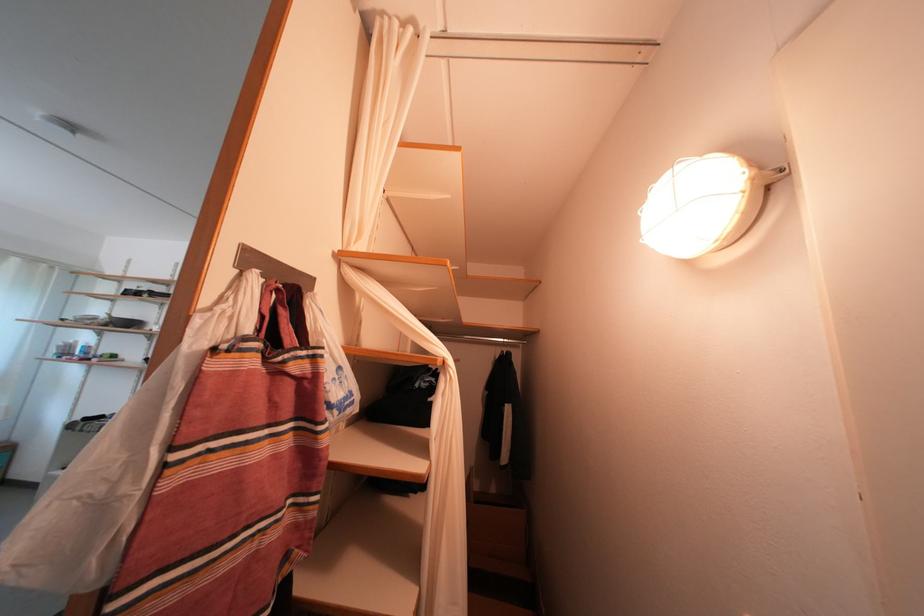
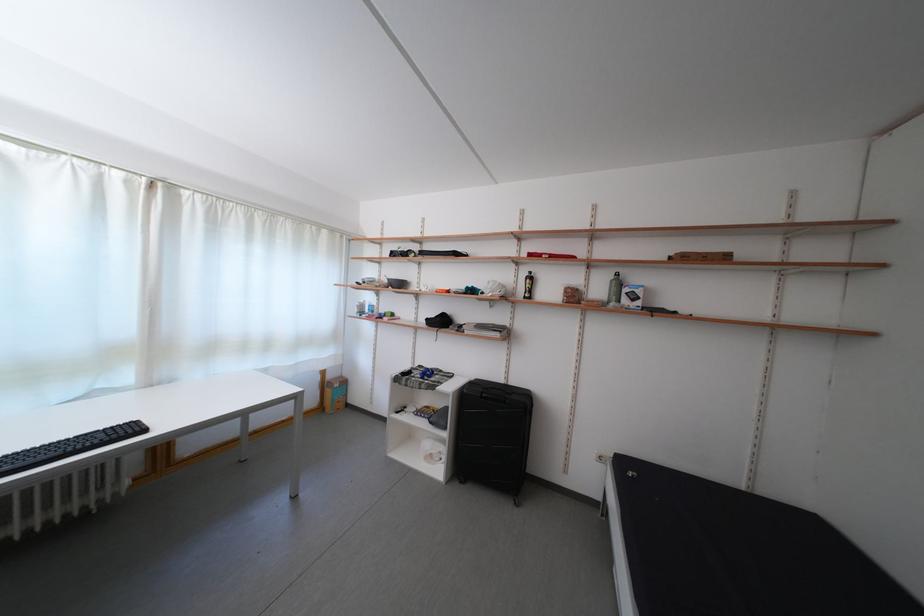
Question: Which direction would the cameraman need to move to produce the second image? Reply with the corresponding letter.

Choices:
 (A) Left
 (B) Right
 (C) Forward
 (D) Backward

Answer: (A)